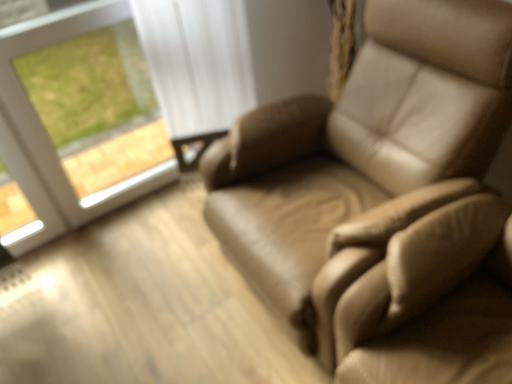
Question: Based on their positions, is leather chair at right located to the left or right of white glass window at upper left?

Choices:
 (A) left
 (B) right

Answer: (B)

Question: Which is correct: leather chair at right is inside white glass window at upper left, or outside of it?

Choices:
 (A) outside
 (B) inside

Answer: (A)

Question: From their relative heights in the image, would you say leather chair at right is taller or shorter than white glass window at upper left?

Choices:
 (A) short
 (B) tall

Answer: (A)

Question: In terms of width, does white glass window at upper left look wider or thinner when compared to leather chair at right?

Choices:
 (A) wide
 (B) thin

Answer: (B)

Question: Considering the positions of point (3, 155) and point (378, 297), is point (3, 155) closer or farther from the camera than point (378, 297)?

Choices:
 (A) closer
 (B) farther

Answer: (B)

Question: Is white glass window at upper left taller or shorter than leather chair at right?

Choices:
 (A) short
 (B) tall

Answer: (B)

Question: Is white glass window at upper left situated inside leather chair at right or outside?

Choices:
 (A) outside
 (B) inside

Answer: (A)